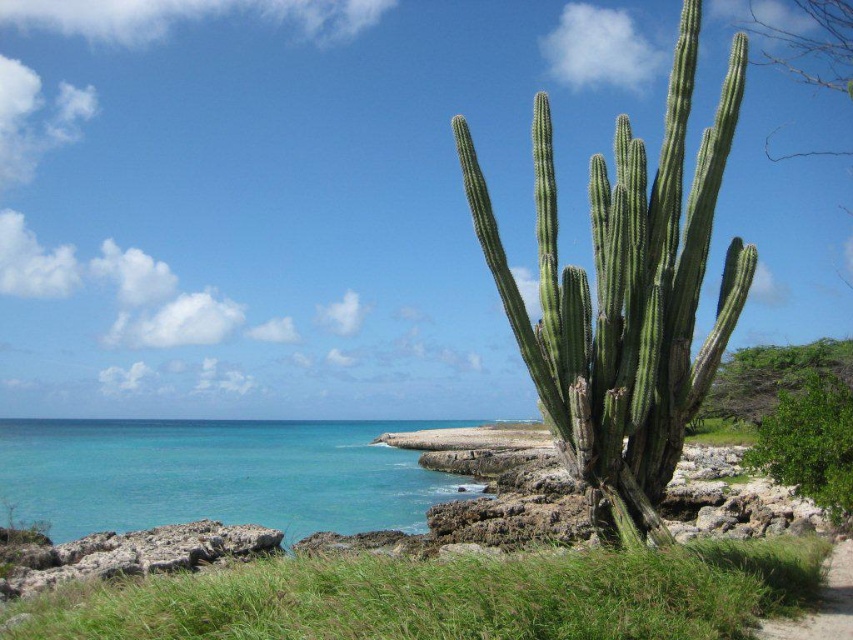
Question: Can you confirm if green succulent cactus at right is smaller than dirt path at lower right?

Choices:
 (A) yes
 (B) no

Answer: (B)

Question: Based on their relative distances, which object is nearer to the green succulent cactus at right?

Choices:
 (A) turquoise water at lower left
 (B) dirt path at lower right

Answer: (B)

Question: Which point appears farthest from the camera in this image?

Choices:
 (A) (838, 572)
 (B) (659, 275)

Answer: (A)

Question: Which point is closer to the camera taking this photo?

Choices:
 (A) (42, 502)
 (B) (744, 72)

Answer: (B)

Question: Does turquoise water at lower left lie behind dirt path at lower right?

Choices:
 (A) yes
 (B) no

Answer: (A)

Question: Is green succulent cactus at right smaller than dirt path at lower right?

Choices:
 (A) yes
 (B) no

Answer: (B)